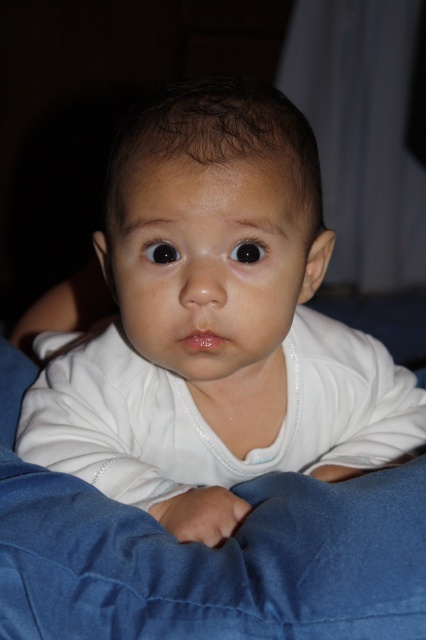
You are a photographer setting up a shoot for a baby product advertisement. The scene requires the white smooth baby at center and the denim at center to be clearly visible. Based on their sizes, which object should you adjust your camera focus to prioritize for better clarity?

The white smooth baby at center is larger in size than the denim at center, so you should prioritize focusing on the white smooth baby at center to ensure it appears clearer in the photo.